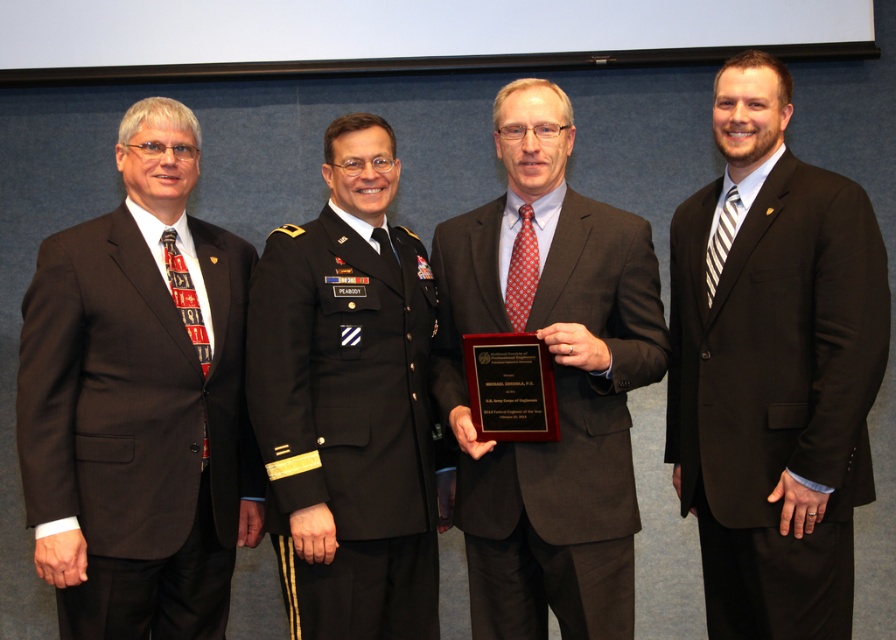
You are a photographer at a formal event. You need to adjust the lighting so that both the brown wool suit at left and the matte black suit at center are evenly illuminated. Considering their positions, which suit is closer to the light source?

The brown wool suit at left is closer to the light source since it is only 24.63 inches away from the matte black suit at center, implying they are nearly the same distance. However, without knowing the exact position of the light source, we cannot definitively determine which is closer. Please provide more information about the light source location.

Which man is wearing the black suit at right compared to the matte black suit at center?

The black suit at right is positioned to the right of the matte black suit at center.